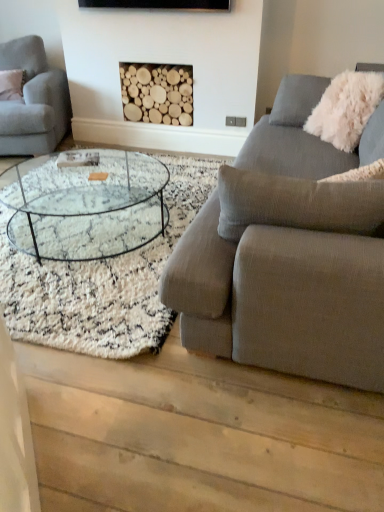
How much space does light gray fabric couch at left, the 2th studio couch when ordered from front to back, occupy vertically?

33.43 inches.

What do you see at coordinates (33, 101) in the screenshot? I see `light gray fabric couch at left, positioned as the 2th studio couch in right-to-left order` at bounding box center [33, 101].

Locate an element on the screen. The height and width of the screenshot is (512, 384). natural wood logs at center is located at coordinates (157, 93).

The image size is (384, 512). What do you see at coordinates (346, 108) in the screenshot? I see `white fluffy pillow at upper right` at bounding box center [346, 108].

Find the location of a particular element. The width and height of the screenshot is (384, 512). light gray fabric couch at left, the 2th studio couch when ordered from front to back is located at coordinates (33, 101).

Is point (383, 79) in front of point (51, 81)?

Yes, it is in front of point (51, 81).

Which of these two, white fluffy pillow at upper right or light gray fabric couch at left, the 2th studio couch when ordered from front to back, stands shorter?

Standing shorter between the two is white fluffy pillow at upper right.

Can you confirm if white fluffy pillow at upper right is thinner than light gray fabric couch at left, the 2th studio couch when ordered from front to back?

Yes, white fluffy pillow at upper right is thinner than light gray fabric couch at left, the 2th studio couch when ordered from front to back.

From a real-world perspective, which is physically above, white fluffy pillow at upper right or clear glass coffee table at center?

white fluffy pillow at upper right is physically above.

Is white fluffy pillow at upper right shorter than clear glass coffee table at center?

No.

In the scene shown: Between white fluffy pillow at upper right and clear glass coffee table at center, which one is positioned in front?

clear glass coffee table at center is closer to the camera.

Can you see white fluffy pillow at upper right touching clear glass coffee table at center?

They are not placed beside each other.

From the picture: How much distance is there between natural wood logs at center and light gray fabric couch at left, which appears as the 1th studio couch when viewed from the back?

The distance of natural wood logs at center from light gray fabric couch at left, which appears as the 1th studio couch when viewed from the back, is 32.87 inches.

Looking at their sizes, would you say natural wood logs at center is wider or thinner than light gray fabric couch at left, which appears as the 1th studio couch when viewed from the back?

In the image, natural wood logs at center appears to be more narrow than light gray fabric couch at left, which appears as the 1th studio couch when viewed from the back.

Which point is more distant from viewer, [164,70] or [26,141]?

The point [164,70] is farther.

Consider the image. Between natural wood logs at center and light gray fabric couch at left, positioned as the 2th studio couch in right-to-left order, which one is positioned behind?

natural wood logs at center.

From a real-world perspective, which is physically above, light gray fabric couch at left, the 2th studio couch when ordered from front to back, or clear glass coffee table at center?

light gray fabric couch at left, the 2th studio couch when ordered from front to back, from a real-world perspective.

Can you confirm if light gray fabric couch at left, the 2th studio couch when ordered from front to back, is taller than clear glass coffee table at center?

Indeed, light gray fabric couch at left, the 2th studio couch when ordered from front to back, has a greater height compared to clear glass coffee table at center.

Can you confirm if light gray fabric couch at left, which appears as the 1th studio couch when viewed from the back, is bigger than clear glass coffee table at center?

Yes, light gray fabric couch at left, which appears as the 1th studio couch when viewed from the back, is bigger than clear glass coffee table at center.

Could you tell me if natural wood logs at center is turned towards clear glass coffee table at center?

Yes, natural wood logs at center is oriented towards clear glass coffee table at center.

Which of these two, natural wood logs at center or clear glass coffee table at center, stands taller?

natural wood logs at center.

Can you confirm if natural wood logs at center is smaller than clear glass coffee table at center?

Yes.

Can you confirm if clear glass coffee table at center is positioned to the left of textured gray couch at right, marked as the second studio couch in a left-to-right arrangement?

Yes.

Which object is thinner, clear glass coffee table at center or textured gray couch at right, the 1th studio couch from the right?

textured gray couch at right, the 1th studio couch from the right.

Is clear glass coffee table at center inside the boundaries of textured gray couch at right, the first studio couch when ordered from front to back, or outside?

The correct answer is: outside.

Is point (66, 238) positioned in front of point (272, 335)?

No, (66, 238) is further to viewer.

Is point (21, 104) behind point (190, 113)?

No, it is not.

From the image's perspective, does light gray fabric couch at left, which is the 1th studio couch in left-to-right order, appear lower than natural wood logs at center?

Correct, light gray fabric couch at left, which is the 1th studio couch in left-to-right order, appears lower than natural wood logs at center in the image.

The height and width of the screenshot is (512, 384). I want to click on the 1st studio couch below the natural wood logs at center (from a real-world perspective), so click(x=33, y=101).

In the scene shown: Which is correct: light gray fabric couch at left, which is the 1th studio couch in left-to-right order, is inside natural wood logs at center, or outside of it?

light gray fabric couch at left, which is the 1th studio couch in left-to-right order, cannot be found inside natural wood logs at center.

From a real-world perspective, starting from the white fluffy pillow at upper right, which studio couch is the 1st one below it? Please provide its 2D coordinates.

[(33, 101)]

Locate an element on the screen. The height and width of the screenshot is (512, 384). pillow lying above the clear glass coffee table at center (from the image's perspective) is located at coordinates (346, 108).

Looking at this image, when comparing their distances from textured gray couch at right, the 1th studio couch from the right, does clear glass coffee table at center or white fluffy pillow at upper right seem further?

white fluffy pillow at upper right is further to textured gray couch at right, the 1th studio couch from the right.

Estimate the real-world distances between objects in this image. Which object is closer to light gray fabric couch at left, which is the 1th studio couch in left-to-right order, white fluffy pillow at upper right or textured gray couch at right, the first studio couch when ordered from front to back?

white fluffy pillow at upper right lies closer to light gray fabric couch at left, which is the 1th studio couch in left-to-right order, than the other object.

Based on their spatial positions, is natural wood logs at center or clear glass coffee table at center closer to textured gray couch at right, marked as the second studio couch in a left-to-right arrangement?

Based on the image, clear glass coffee table at center appears to be nearer to textured gray couch at right, marked as the second studio couch in a left-to-right arrangement.

Considering their positions, is light gray fabric couch at left, which appears as the 1th studio couch when viewed from the back, positioned further to clear glass coffee table at center than textured gray couch at right, the first studio couch when ordered from front to back?

Based on the image, textured gray couch at right, the first studio couch when ordered from front to back, appears to be further to clear glass coffee table at center.

Estimate the real-world distances between objects in this image. Which object is closer to textured gray couch at right, marked as the second studio couch in a left-to-right arrangement, clear glass coffee table at center or natural wood logs at center?

clear glass coffee table at center.

Considering their positions, is natural wood logs at center positioned further to light gray fabric couch at left, which appears as the 1th studio couch when viewed from the back, than textured gray couch at right, the first studio couch when ordered from front to back?

textured gray couch at right, the first studio couch when ordered from front to back, is positioned further to the anchor light gray fabric couch at left, which appears as the 1th studio couch when viewed from the back.

From the image, which object appears to be farther from white fluffy pillow at upper right, clear glass coffee table at center or natural wood logs at center?

clear glass coffee table at center.

Which object lies further to the anchor point white fluffy pillow at upper right, textured gray couch at right, positioned as the second studio couch in back-to-front order, or clear glass coffee table at center?

Among the two, textured gray couch at right, positioned as the second studio couch in back-to-front order, is located further to white fluffy pillow at upper right.

Where is `fireplace between light gray fabric couch at left, the 2th studio couch when ordered from front to back, and white fluffy pillow at upper right`? fireplace between light gray fabric couch at left, the 2th studio couch when ordered from front to back, and white fluffy pillow at upper right is located at coordinates (157, 93).

This screenshot has width=384, height=512. Identify the location of studio couch situated between clear glass coffee table at center and white fluffy pillow at upper right from left to right. (282, 262).

Find the location of a particular element. The image size is (384, 512). pillow between textured gray couch at right, the first studio couch when ordered from front to back, and natural wood logs at center in the front-back direction is located at coordinates (346, 108).

You are a GUI agent. You are given a task and a screenshot of the screen. Output one action in this format:
    pyautogui.click(x=<x>, y=<y>)
    Task: Click on the studio couch located between light gray fabric couch at left, positioned as the 2th studio couch in right-to-left order, and white fluffy pillow at upper right in the left-right direction
    This screenshot has height=512, width=384.
    Given the screenshot: What is the action you would take?
    pyautogui.click(x=282, y=262)